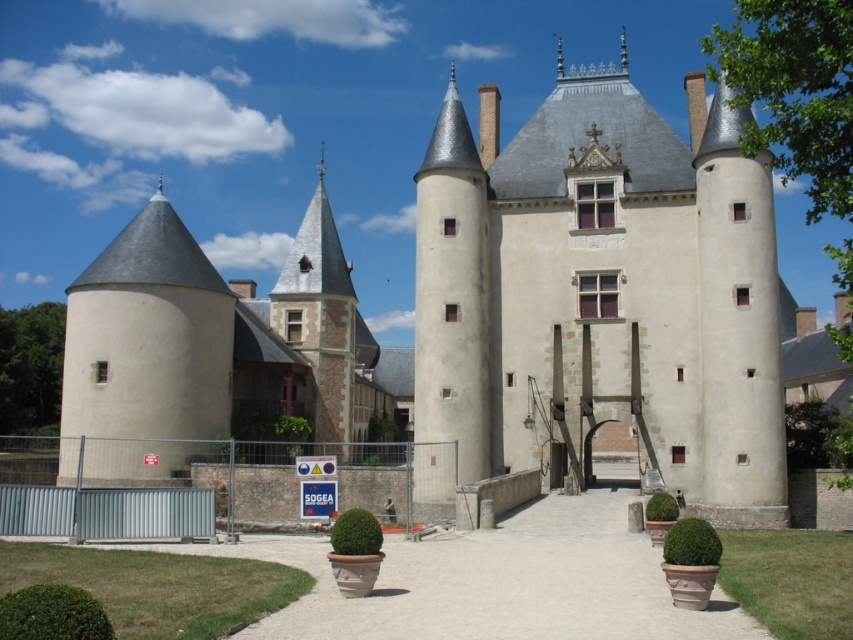
You are an architect examining the castle from the ground. You notice two towers labeled as smooth beige stone tower at center and smooth beige tower at left. Which tower is positioned higher in the image?

The smooth beige stone tower at center is positioned higher than the smooth beige tower at left in the image.

You are standing in front of the castle and want to take a photo of the smooth beige stone tower at center. If your camera can focus up to 60 meters, will it be able to capture the tower clearly?

The smooth beige stone tower at center is 61.20 meters away from camera, so the camera cannot focus on it clearly since it exceeds the maximum focus distance of 60 meters.

You are standing in front of the castle and notice two towers. The first is the smooth beige tower at left, and the second is the smooth beige stone tower at center. From your vantage point, which tower is positioned to the right of the other?

The smooth beige stone tower at center is positioned to the right of the smooth beige tower at left.